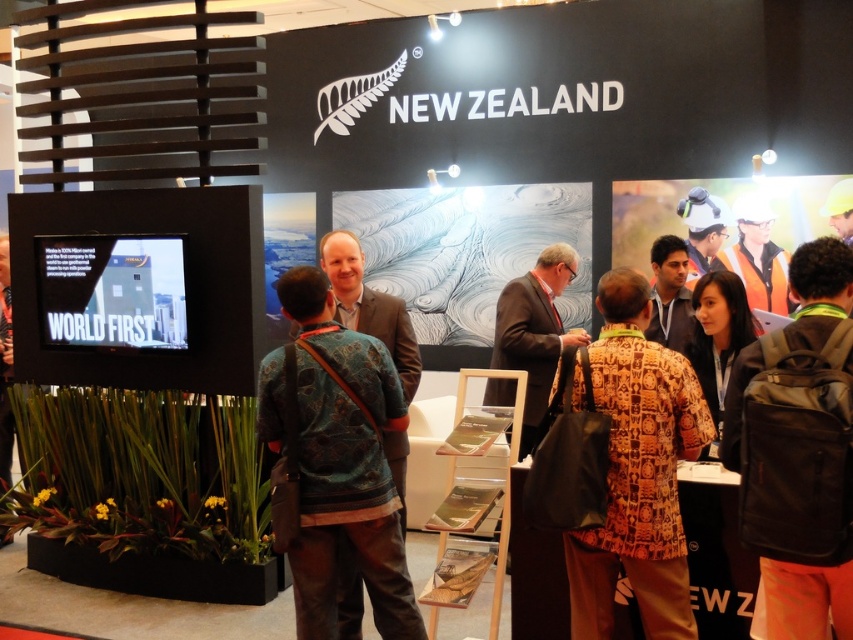
You are standing at the entrance of the New Zealand exhibition booth and notice two points marked on the floor. The first point is at coordinate point (335,461) and the second is at coordinate point (712,266). If you want to walk towards the point that is closer to the entrance, which coordinate should you head towards?

You should head towards point (335,461) because it is in front of point (712,266), meaning it is closer to the entrance.